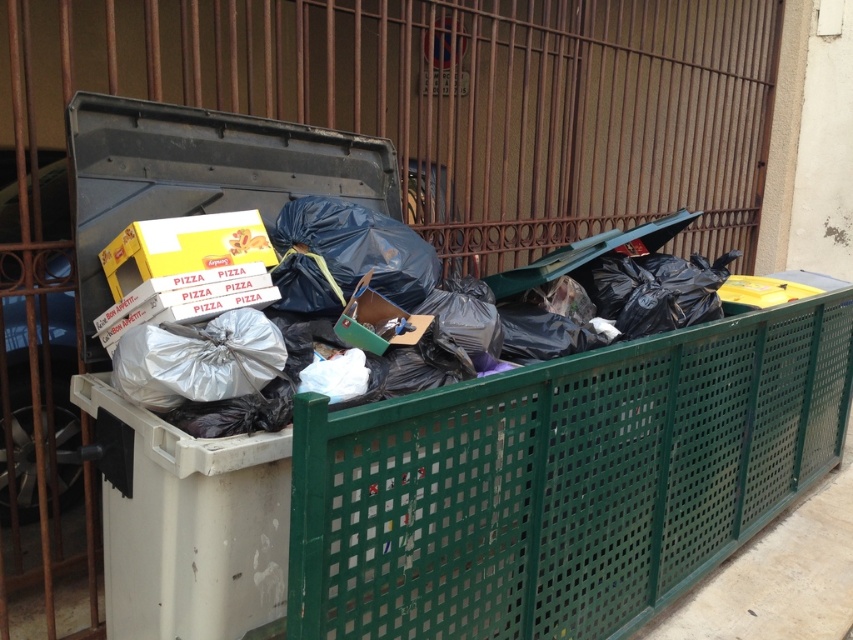
Question: Which point is closer to the camera?

Choices:
 (A) (148, 268)
 (B) (460, 364)

Answer: (A)

Question: Among these objects, which one is nearest to the camera?

Choices:
 (A) white cardboard pizza box at upper left
 (B) shiny metallic trash bin at center

Answer: (B)

Question: In this image, where is shiny metallic trash bin at center located relative to white cardboard pizza box at upper left?

Choices:
 (A) right
 (B) left

Answer: (A)

Question: Where is shiny metallic trash bin at center located in relation to white cardboard pizza box at upper left in the image?

Choices:
 (A) left
 (B) right

Answer: (B)

Question: Which point is farther from the camera taking this photo?

Choices:
 (A) (219, 216)
 (B) (560, 339)

Answer: (B)

Question: Is shiny metallic trash bin at center positioned in front of white cardboard pizza box at upper left?

Choices:
 (A) yes
 (B) no

Answer: (A)